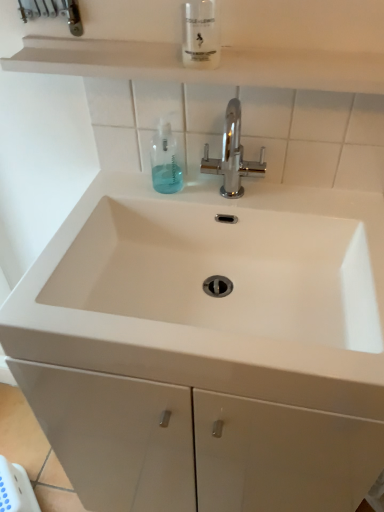
Question: Are translucent plastic mouthwash at center, acting as the 1th mouthwash starting from the left, and white matte shelf at upper center making contact?

Choices:
 (A) no
 (B) yes

Answer: (A)

Question: Does translucent plastic mouthwash at center, the first mouthwash ordered from the bottom, lie behind white matte shelf at upper center?

Choices:
 (A) yes
 (B) no

Answer: (A)

Question: Considering the relative sizes of translucent plastic mouthwash at center, placed as the 2th mouthwash when sorted from top to bottom, and white matte shelf at upper center in the image provided, is translucent plastic mouthwash at center, placed as the 2th mouthwash when sorted from top to bottom, bigger than white matte shelf at upper center?

Choices:
 (A) yes
 (B) no

Answer: (B)

Question: Is translucent plastic mouthwash at center, positioned as the second mouthwash in front-to-back order, looking in the opposite direction of white matte shelf at upper center?

Choices:
 (A) no
 (B) yes

Answer: (A)

Question: From a real-world perspective, is translucent plastic mouthwash at center, which is counted as the 2th mouthwash, starting from the right, over white matte shelf at upper center?

Choices:
 (A) no
 (B) yes

Answer: (A)

Question: Are clear plastic bottle at upper center, the second mouthwash viewed from the left, and translucent plastic mouthwash at center, which is counted as the 2th mouthwash, starting from the right, beside each other?

Choices:
 (A) yes
 (B) no

Answer: (B)

Question: Could you tell me if clear plastic bottle at upper center, which is the 2th mouthwash from bottom to top, is turned towards translucent plastic mouthwash at center, placed as the 2th mouthwash when sorted from top to bottom?

Choices:
 (A) no
 (B) yes

Answer: (A)

Question: From a real-world perspective, is clear plastic bottle at upper center, which is the 1th mouthwash in right-to-left order, physically below translucent plastic mouthwash at center, positioned as the second mouthwash in front-to-back order?

Choices:
 (A) no
 (B) yes

Answer: (A)

Question: Can you confirm if clear plastic bottle at upper center, which is the 2th mouthwash from bottom to top, is bigger than translucent plastic mouthwash at center, the first mouthwash ordered from the bottom?

Choices:
 (A) no
 (B) yes

Answer: (B)

Question: Is clear plastic bottle at upper center, which is the 2th mouthwash from bottom to top, not close to translucent plastic mouthwash at center, which is counted as the 1th mouthwash, starting from the back?

Choices:
 (A) no
 (B) yes

Answer: (A)

Question: From the image's perspective, is clear plastic bottle at upper center, which is the first mouthwash from top to bottom, on translucent plastic mouthwash at center, which is counted as the 2th mouthwash, starting from the right?

Choices:
 (A) no
 (B) yes

Answer: (B)

Question: Is chrome metallic faucet at center taller than clear plastic bottle at upper center, which is the first mouthwash from top to bottom?

Choices:
 (A) yes
 (B) no

Answer: (A)